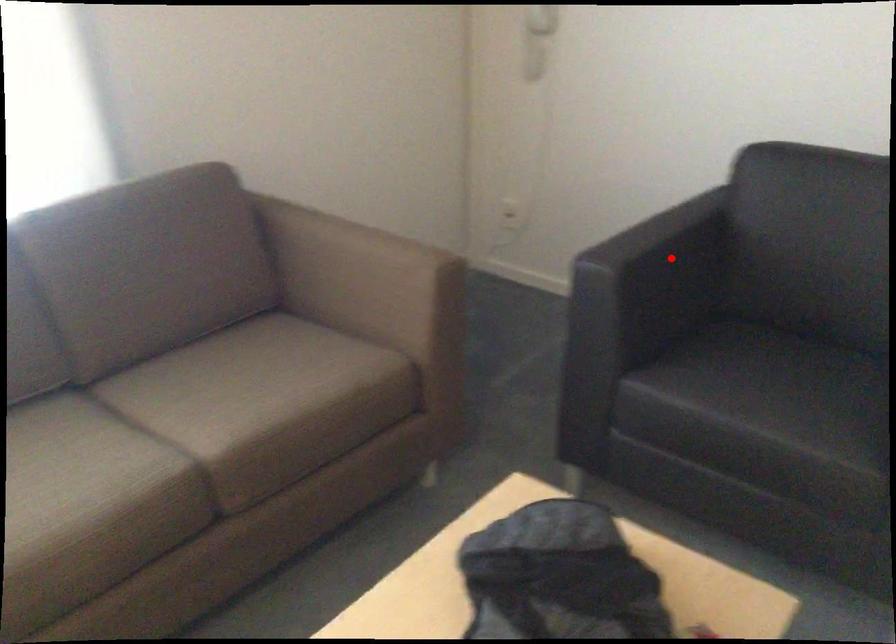
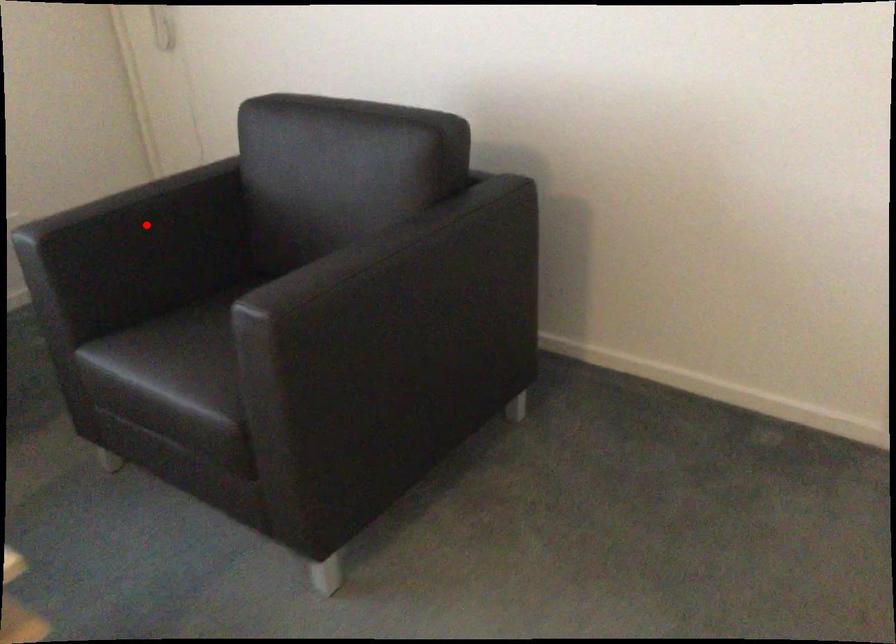
In the scene shown: I am providing you with two images of the same scene from different viewpoints. A red point is marked on the first image and another point is marked on the second image. Is the marked point in image1 the same physical position as the marked point in image2?

Yes